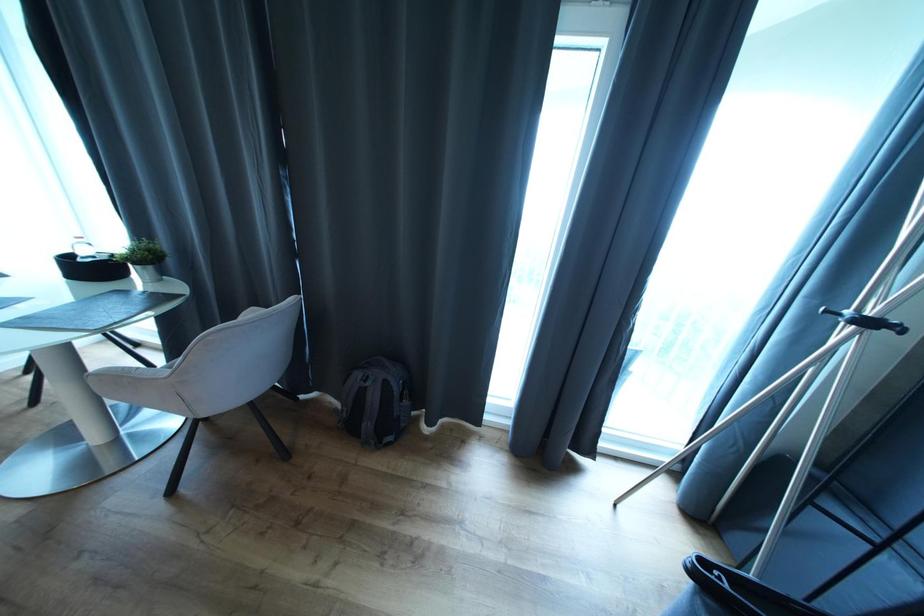
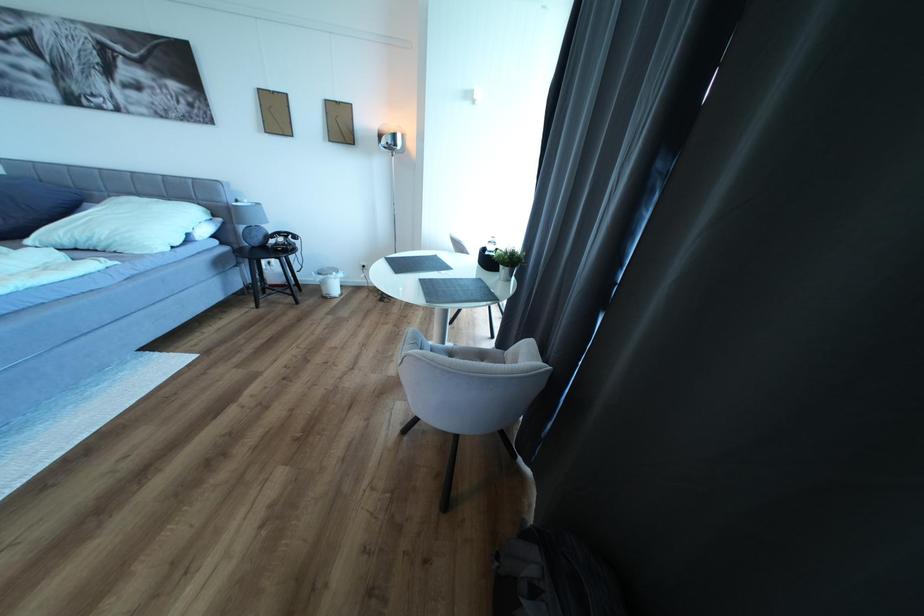
The first image is from the beginning of the video and the second image is from the end. How did the camera likely rotate when shooting the video?

The camera rotated toward left-down.